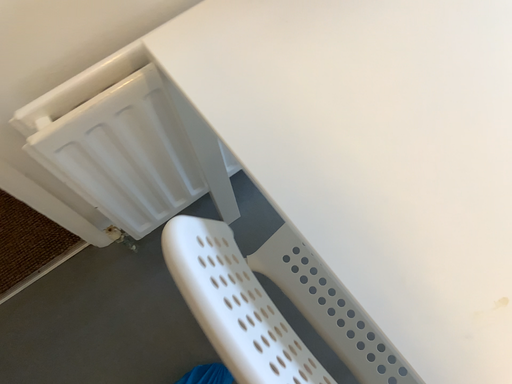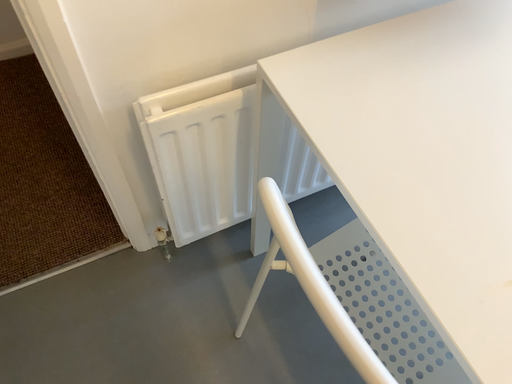
Question: How did the camera likely rotate when shooting the video?

Choices:
 (A) rotated downward
 (B) rotated upward

Answer: (B)